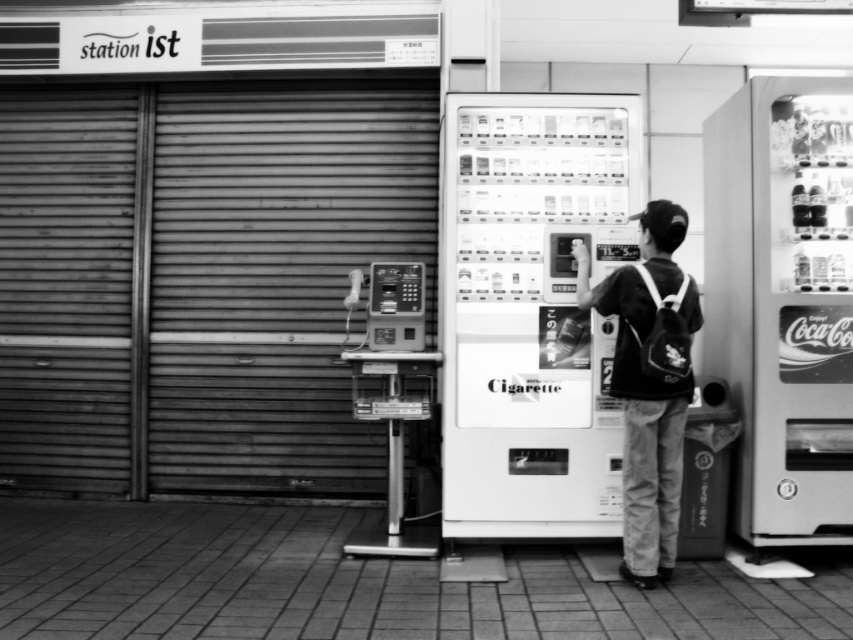
Question: Is metallic gray garage door at left further to camera compared to dark fabric backpack at center?

Choices:
 (A) no
 (B) yes

Answer: (B)

Question: Which point is closer to the camera?

Choices:
 (A) metallic gray garage door at left
 (B) dark fabric backpack at center

Answer: (B)

Question: Is metallic gray garage door at left further to the viewer compared to metallic silver vending machine at right?

Choices:
 (A) no
 (B) yes

Answer: (B)

Question: Does metallic gray garage door at left appear over metallic silver vending machine at right?

Choices:
 (A) no
 (B) yes

Answer: (B)

Question: Which point is farther to the camera?

Choices:
 (A) metallic silver vending machine at right
 (B) dark fabric backpack at center
 (C) metallic gray garage door at left

Answer: (C)

Question: Which point is closer to the camera?

Choices:
 (A) (650, 262)
 (B) (815, 328)
 (C) (242, 124)

Answer: (A)